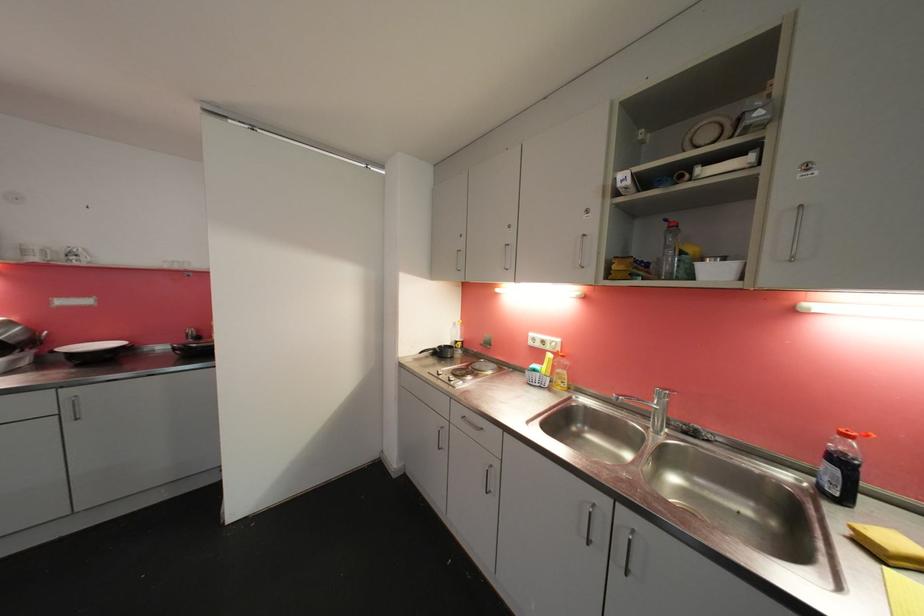
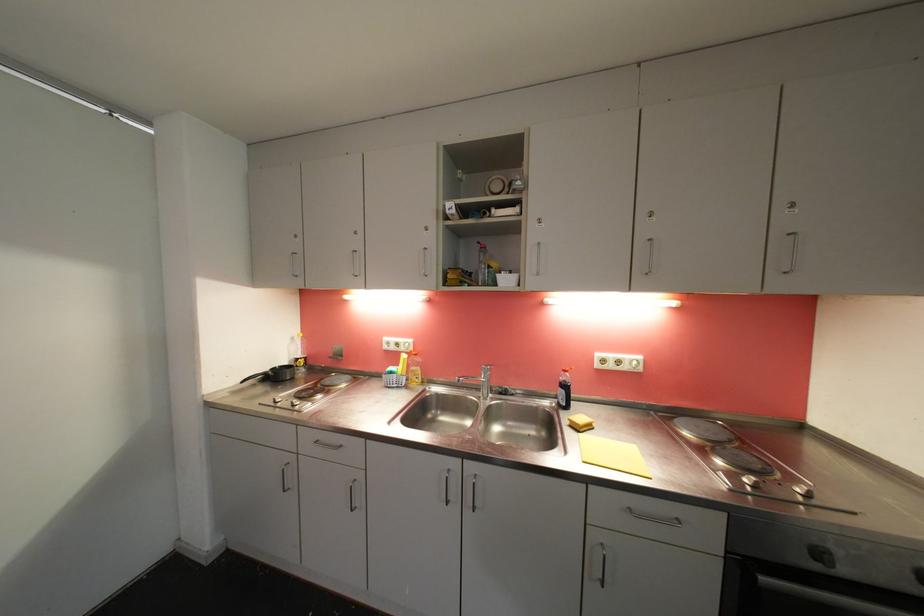
Question: The first image is from the beginning of the video and the second image is from the end. How did the camera likely rotate when shooting the video?

Choices:
 (A) Left
 (B) Right
 (C) Up
 (D) Down

Answer: (B)